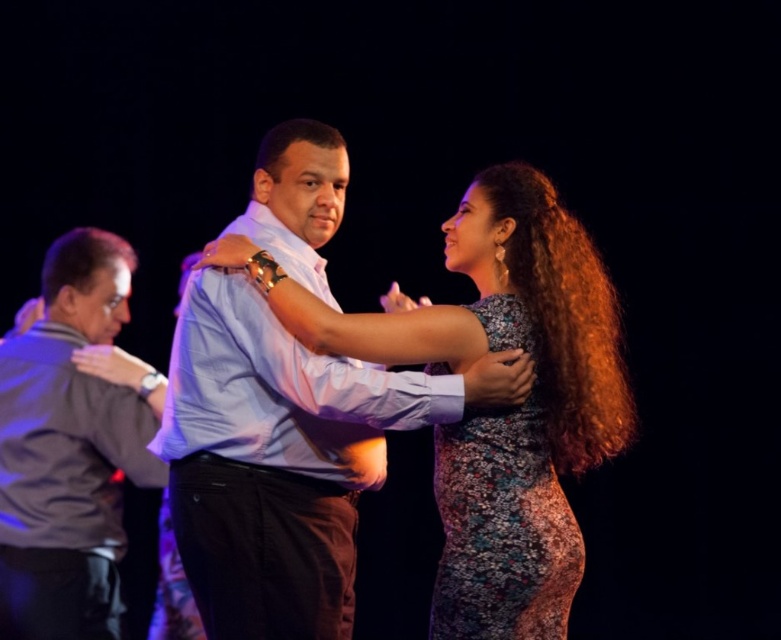
You are a photographer at the dance event and want to capture the floral dress at center. Based on the coordinates provided, where should you position your camera to ensure the dress is in the center of your shot?

The floral dress at center is located at point (500, 412), so you should position your camera to aim directly at those coordinates to center the dress in your shot.

You are a photographer at the event and want to capture a clear photo of both the floral dress at center and the gray fabric shirt at left. However, the camera can only focus on one object at a time. Which object should you focus on to ensure the other remains in the background?

The floral dress at center is positioned over the gray fabric shirt at left, so focusing on the floral dress at center will place the gray fabric shirt at left in the background.

You are a photographer at the dance event and want to capture a photo of both the floral dress at center and the floral lace dress at center. Since you can only focus on one dress clearly, which dress should you choose to ensure it appears larger in the final photo?

The floral dress at center is larger in size than the floral lace dress at center, so you should focus on the floral dress at center to ensure it appears larger in the final photo.